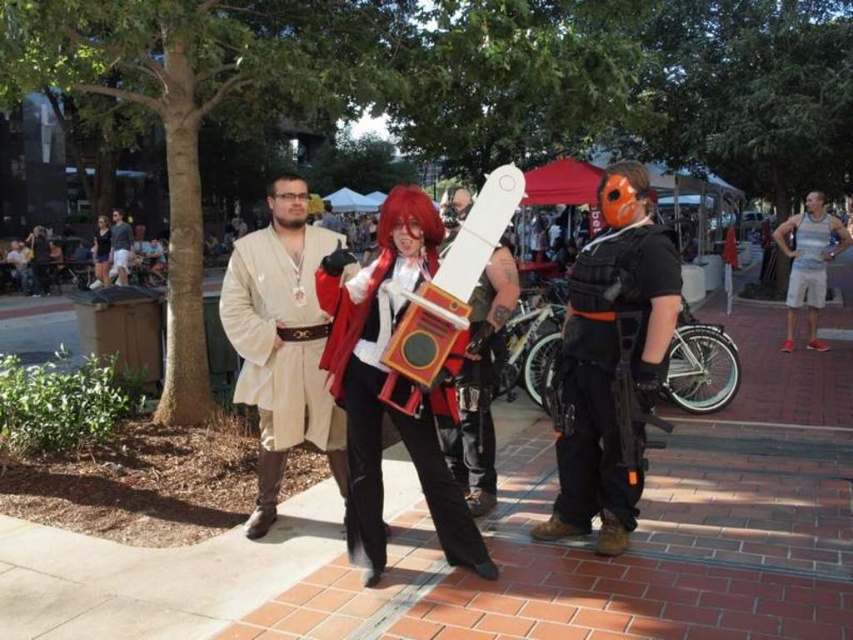
You are a delivery person trying to navigate through the event area. You need to move from the brick pavement at center to the black matte tactical vest at center. Considering the widths, which path would allow you to pass through without needing to adjust your route?

The brick pavement at center has a lesser width compared to the black matte tactical vest at center, so you can pass through the path next to the black matte tactical vest at center since it is wider.

You are standing at the edge of the scene and want to walk towards the beige fabric robe at center. Which direction should you move relative to the brick pavement at center?

The beige fabric robe at center is to the left of the brick pavement at center. To reach the beige fabric robe at center, you should move to the left side of the brick pavement at center.

You are a delivery person with a cart that is 5 feet wide. You need to move from the brick pavement at center to the black matte tactical vest at center. Is there enough space for your cart to pass through the path between them?

The distance between the brick pavement at center and the black matte tactical vest at center is 6.26 feet. Since your cart is 5 feet wide, there is sufficient space for it to pass through the path between them.